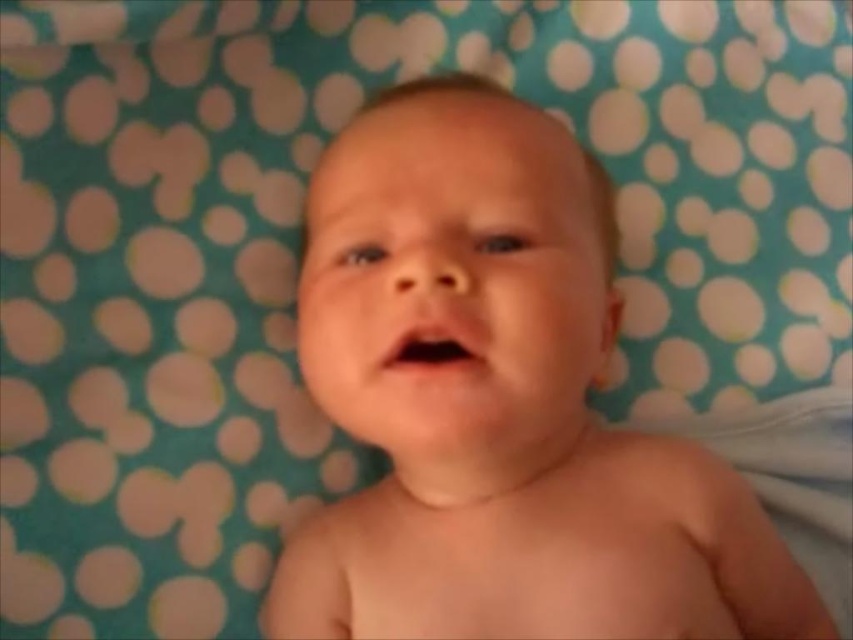
Question: Can you confirm if smooth skin baby at center is wider than pink smooth mouth at center?

Choices:
 (A) yes
 (B) no

Answer: (A)

Question: Which point is farther from the camera taking this photo?

Choices:
 (A) (393, 342)
 (B) (556, 456)

Answer: (B)

Question: Can you confirm if smooth skin baby at center is positioned above pink smooth mouth at center?

Choices:
 (A) no
 (B) yes

Answer: (A)

Question: Which point is farther to the camera?

Choices:
 (A) pink smooth mouth at center
 (B) smooth skin baby at center

Answer: (A)

Question: Observing the image, what is the correct spatial positioning of smooth skin baby at center in reference to pink smooth mouth at center?

Choices:
 (A) above
 (B) below

Answer: (B)